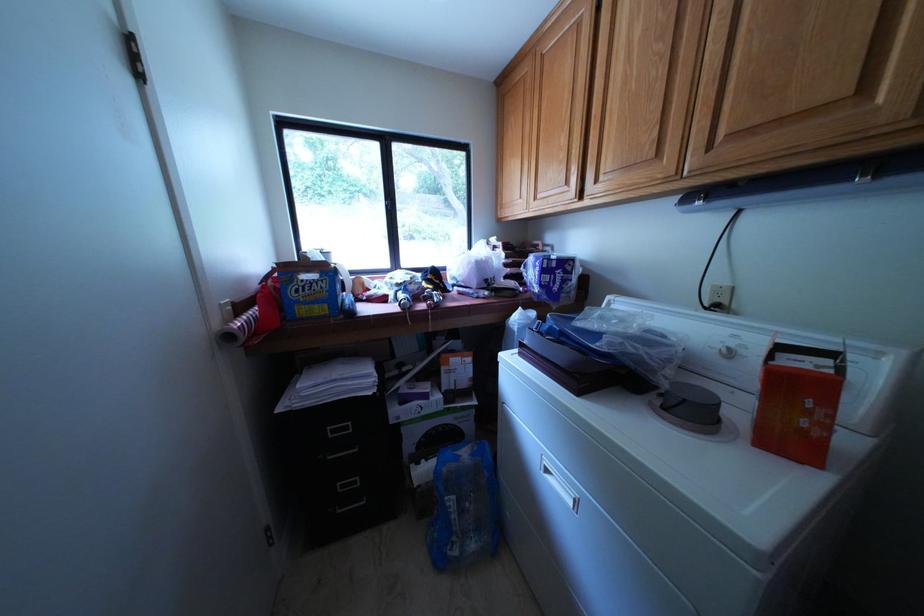
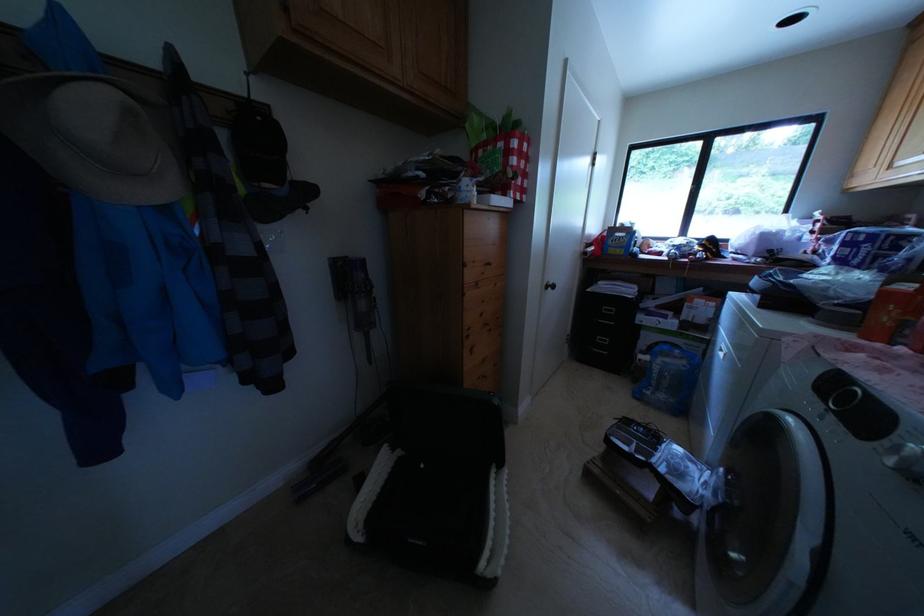
Find the pixel in the second image that matches [417,430] in the first image.

(655, 333)